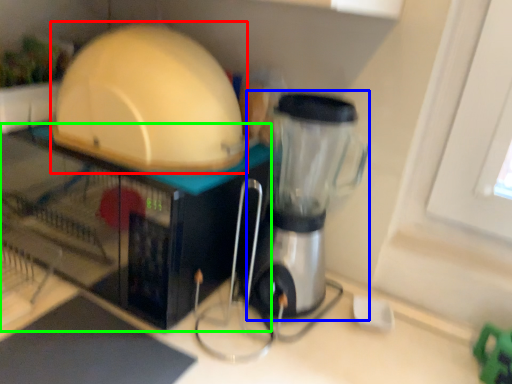
Question: Considering the real-world distances, which object is closest to appliance (highlighted by a red box)? blender (highlighted by a blue box) or appliance (highlighted by a green box).

Choices:
 (A) blender
 (B) appliance

Answer: (B)